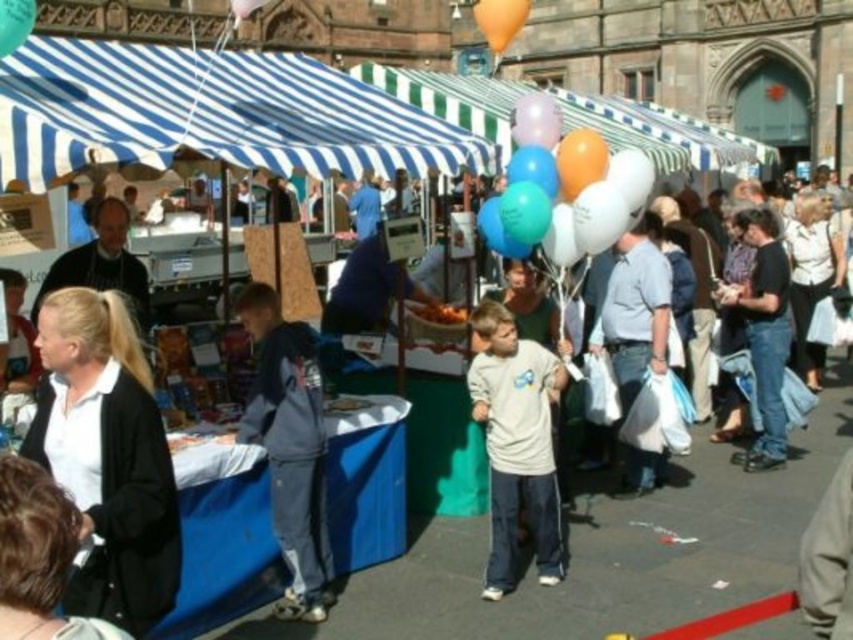
From the picture: You are a photographer trying to capture a photo of the orange matte balloon at upper center without the dark gray fleece jacket at center blocking the view. Is this possible based on their positions?

The dark gray fleece jacket at center is closer to the viewer than the orange matte balloon at upper center, so the jacket would block the view of the balloon. It is not possible to take a photo of the orange matte balloon at upper center without the jacket blocking it.

You are standing at the entrance of the market and see the orange matte balloon at upper center. Can you determine its exact position using the coordinate system provided?

The orange matte balloon at upper center is located at point (498, 20), so its exact position is at those coordinates.

In the scene shown: You are standing at the market entrance and see the dark gray fleece jacket at center and the orange matte balloon at upper center. Which object is farther away from you?

The dark gray fleece jacket at center is 75.02 feet away from the orange matte balloon at upper center. Since the distance between them is fixed, both objects are at specific distances from your position. However, without knowing your exact location, it is impossible to determine which is farther away based solely on their separation distance.